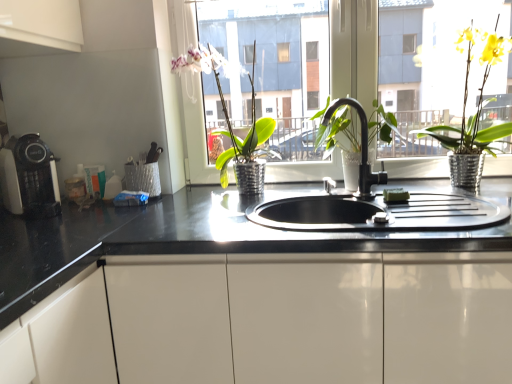
Question: Considering their positions, is black glossy countertop at center located in front of or behind matte black coffee machine at left?

Choices:
 (A) behind
 (B) front

Answer: (B)

Question: Choose the correct answer: Is black glossy countertop at center inside matte black coffee machine at left or outside it?

Choices:
 (A) outside
 (B) inside

Answer: (A)

Question: Estimate the real-world distances between objects in this image. Which object is farther from the black matte faucet at center?

Choices:
 (A) transparent glass window at center
 (B) matte black coffee machine at left
 (C) green metallic pot at center, the 1th houseplant from the left
 (D) black glossy countertop at center
 (E) yellow metallic pot at upper right, placed as the first houseplant when sorted from right to left

Answer: (A)

Question: Based on their relative distances, which object is farther from the green metallic pot at center, which is counted as the second houseplant, starting from the right?

Choices:
 (A) yellow metallic pot at upper right, which is the 2th houseplant from left to right
 (B) transparent glass window at center
 (C) black glossy countertop at center
 (D) matte black coffee machine at left
 (E) black matte faucet at center

Answer: (B)